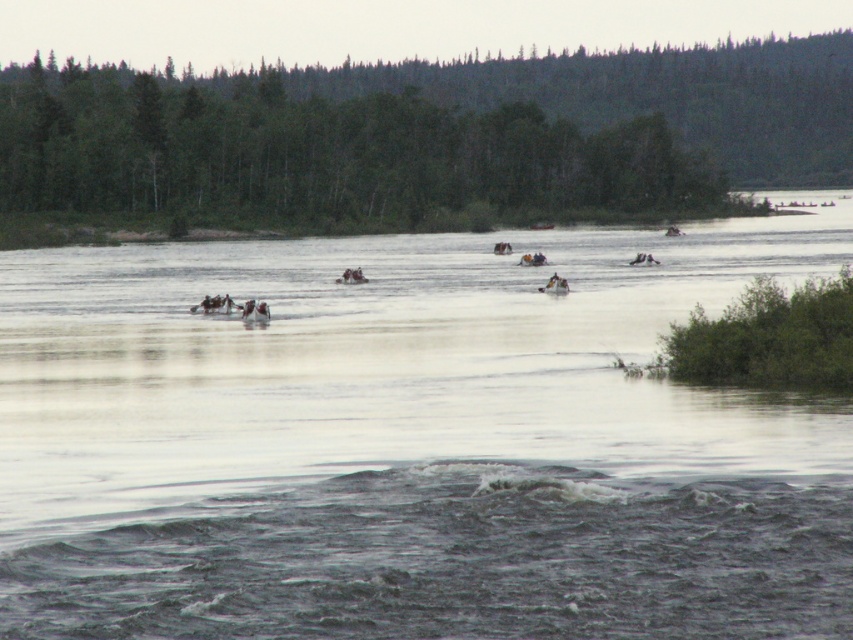
Which of these two, green leafy trees at upper center or white plastic raft at center, stands taller?

With more height is green leafy trees at upper center.

Can you confirm if green leafy trees at upper center is smaller than white plastic raft at center?

No.

This screenshot has width=853, height=640. In order to click on green leafy trees at upper center in this screenshot , I will do `click(326, 156)`.

Between clear water at center and white plastic raft at center, which one is positioned lower?

Positioned lower is clear water at center.

Is clear water at center to the right of white plastic raft at center from the viewer's perspective?

No, clear water at center is not to the right of white plastic raft at center.

Does point (701, 419) come farther from viewer compared to point (525, 260)?

That is False.

Image resolution: width=853 pixels, height=640 pixels. Find the location of `clear water at center`. clear water at center is located at coordinates (413, 442).

Does clear water at center have a larger size compared to green leafy trees at upper center?

Incorrect, clear water at center is not larger than green leafy trees at upper center.

Based on the photo, between clear water at center and green leafy trees at upper center, which one is positioned higher?

green leafy trees at upper center is higher up.

The height and width of the screenshot is (640, 853). I want to click on clear water at center, so click(x=413, y=442).